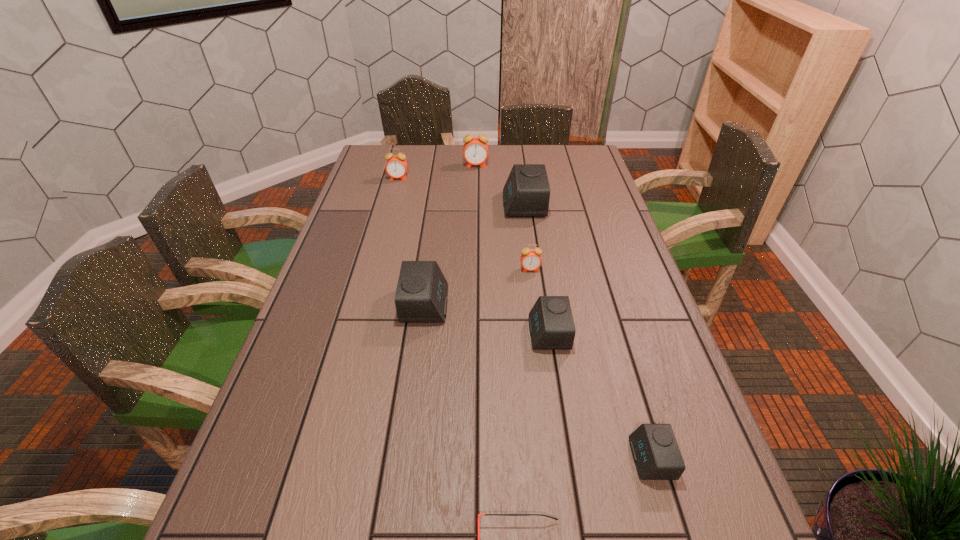
Locate an element on the screen. The width and height of the screenshot is (960, 540). the third biggest black alarm clock is located at coordinates (551, 324).

This screenshot has width=960, height=540. Identify the location of the rightmost alarm clock. (656, 453).

Image resolution: width=960 pixels, height=540 pixels. What are the coordinates of `the rightmost black alarm clock` in the screenshot? It's located at (656, 453).

In order to click on vacant position located on the face of the fifth alarm clock from right to left in this screenshot , I will do `click(475, 188)`.

I want to click on vacant region located 0.130m on the face of the seventh nearest object, so click(x=393, y=199).

Locate an element on the screen. Image resolution: width=960 pixels, height=540 pixels. vacant space situated on the front-facing side of the third farthest object is located at coordinates (420, 205).

At what (x,y) coordinates should I click in order to perform the action: click on vacant area situated 0.180m on the front-facing side of the third farthest object. Please return your answer as a coordinate pair (x, y). The height and width of the screenshot is (540, 960). Looking at the image, I should click on (452, 205).

At what (x,y) coordinates should I click in order to perform the action: click on vacant area located 0.140m on the front-facing side of the third farthest object. Please return your answer as a coordinate pair (x, y). The width and height of the screenshot is (960, 540). Looking at the image, I should click on (464, 205).

This screenshot has width=960, height=540. What are the coordinates of `free space located on the front-facing side of the second alarm clock from left to right` in the screenshot? It's located at (522, 305).

The height and width of the screenshot is (540, 960). In order to click on free space located 0.170m on the face of the smallest pink alarm clock in this screenshot , I will do `click(536, 316)`.